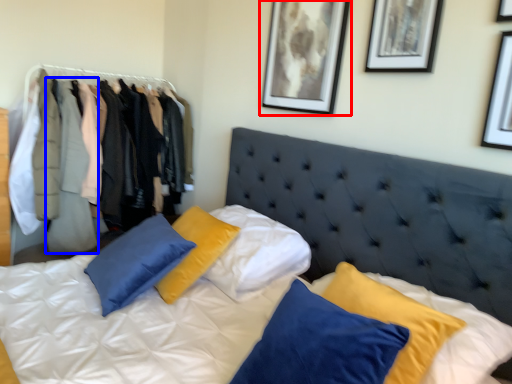
Question: Which object appears closest to the camera in this image, picture frame (highlighted by a red box) or clothing (highlighted by a blue box)?

Choices:
 (A) picture frame
 (B) clothing

Answer: (A)